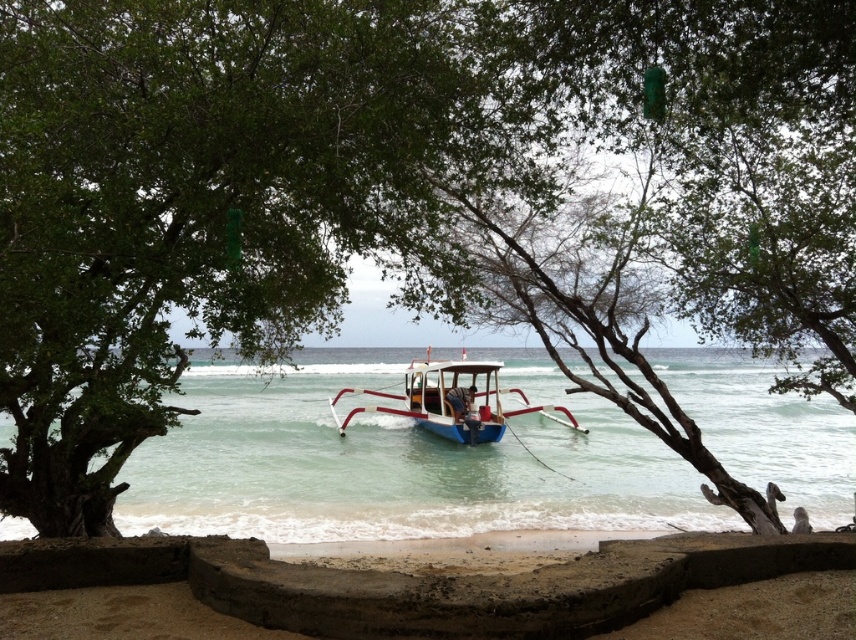
Between blue water at center and blue painted wood boat at center, which one is positioned higher?

blue painted wood boat at center is above.

Is blue water at center to the left of blue painted wood boat at center from the viewer's perspective?

No, blue water at center is not to the left of blue painted wood boat at center.

Identify the location of blue water at center. The image size is (856, 640). (395, 461).